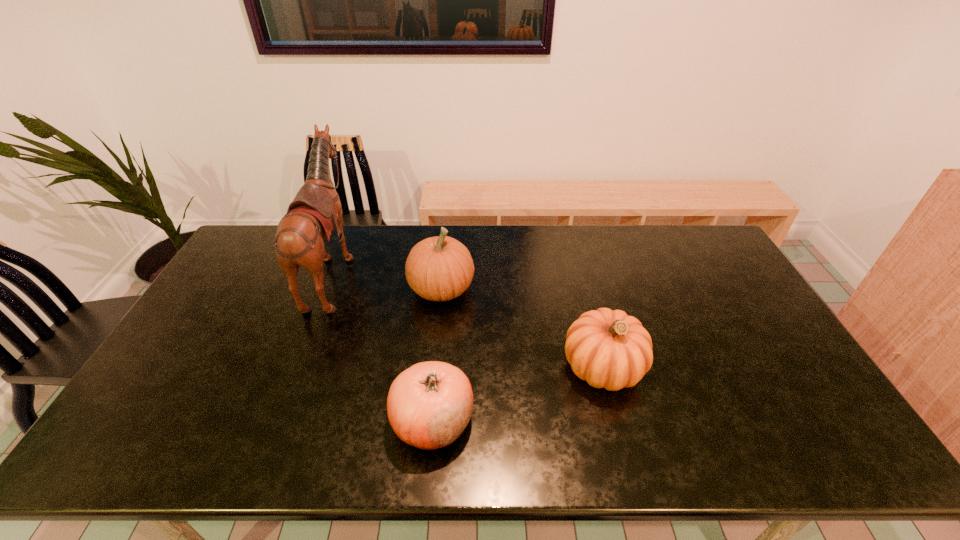
Where is `free space between the rightmost object and the farthest pumpkin`? Image resolution: width=960 pixels, height=540 pixels. free space between the rightmost object and the farthest pumpkin is located at coordinates (522, 328).

Locate which object is the third closest to the rightmost object. Please provide its 2D coordinates. Your answer should be formatted as a tuple, i.e. [(x, y)], where the tuple contains the x and y coordinates of a point satisfying the conditions above.

[(311, 217)]

Locate an element on the screen. object that stands as the closest to the leftmost object is located at coordinates (440, 268).

This screenshot has width=960, height=540. I want to click on pumpkin that is the third nearest to the leftmost object, so click(607, 348).

The height and width of the screenshot is (540, 960). Find the location of `the closest pumpkin to the rightmost object`. the closest pumpkin to the rightmost object is located at coordinates (429, 405).

The image size is (960, 540). I want to click on free space in the image that satisfies the following two spatial constraints: 1. on the back of the saddle; 2. on the back side of the rightmost object, so click(x=298, y=367).

Where is `vacant space that satisfies the following two spatial constraints: 1. on the back of the saddle; 2. on the back side of the rightmost pumpkin`? vacant space that satisfies the following two spatial constraints: 1. on the back of the saddle; 2. on the back side of the rightmost pumpkin is located at coordinates pyautogui.click(x=298, y=367).

Locate an element on the screen. Image resolution: width=960 pixels, height=540 pixels. blank space that satisfies the following two spatial constraints: 1. on the back side of the rightmost object; 2. on the back of the leftmost object is located at coordinates (578, 271).

Find the location of a particular element. free space that satisfies the following two spatial constraints: 1. on the back side of the rightmost object; 2. on the back of the saddle is located at coordinates (578, 271).

Find the location of `free space in the image that satisfies the following two spatial constraints: 1. on the back of the saddle; 2. on the back side of the rightmost pumpkin`. free space in the image that satisfies the following two spatial constraints: 1. on the back of the saddle; 2. on the back side of the rightmost pumpkin is located at coordinates (298, 367).